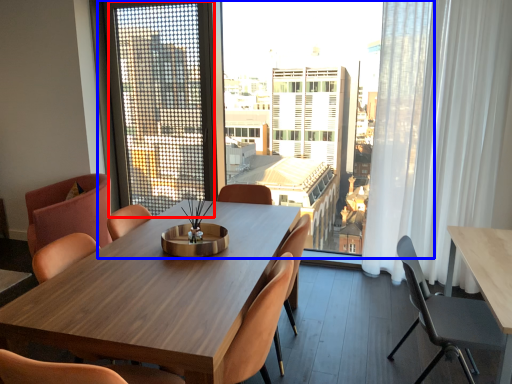
Question: Which object appears farthest to the camera in this image, screen door (highlighted by a red box) or window (highlighted by a blue box)?

Choices:
 (A) screen door
 (B) window

Answer: (A)